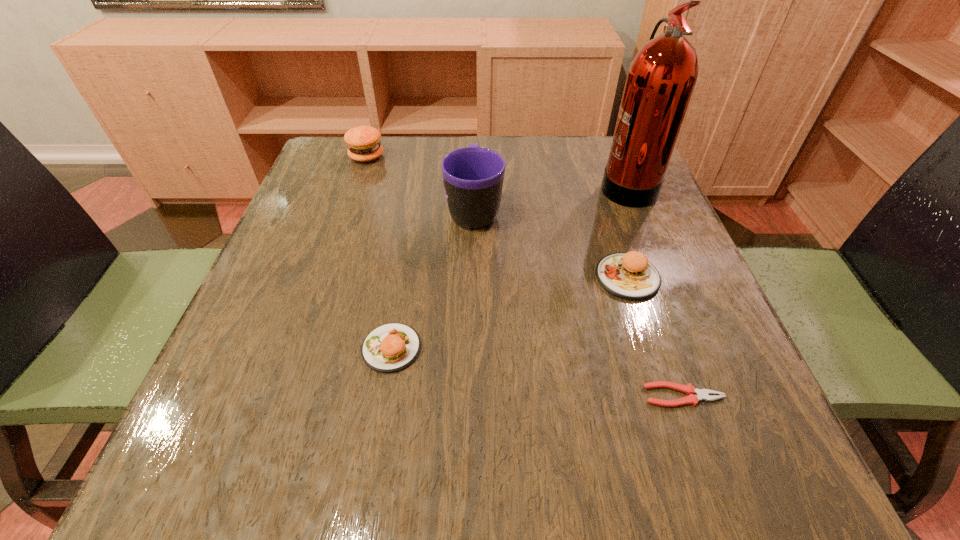
Find the location of `free space between the fourth farthest object and the fire extinguisher`. free space between the fourth farthest object and the fire extinguisher is located at coordinates (627, 231).

Select which object is the fifth closest to the fire extinguisher. Please provide its 2D coordinates. Your answer should be formatted as a tuple, i.e. [(x, y)], where the tuple contains the x and y coordinates of a point satisfying the conditions above.

[(363, 142)]

The image size is (960, 540). What are the coordinates of `object that can be found as the closest to the pliers` in the screenshot? It's located at (630, 275).

Locate an element on the screen. Image resolution: width=960 pixels, height=540 pixels. patty that stands as the second closest to the second tallest object is located at coordinates (363, 142).

Locate an element on the screen. patty that is the closest to the third nearest object is located at coordinates pyautogui.click(x=391, y=347).

The image size is (960, 540). In order to click on vacant space that satisfies the following two spatial constraints: 1. on the front side of the shortest patty; 2. on the right side of the farthest patty in this screenshot , I will do `click(301, 348)`.

Where is `free region that satisfies the following two spatial constraints: 1. on the front-facing side of the fire extinguisher; 2. on the front side of the second tallest patty`? free region that satisfies the following two spatial constraints: 1. on the front-facing side of the fire extinguisher; 2. on the front side of the second tallest patty is located at coordinates (664, 278).